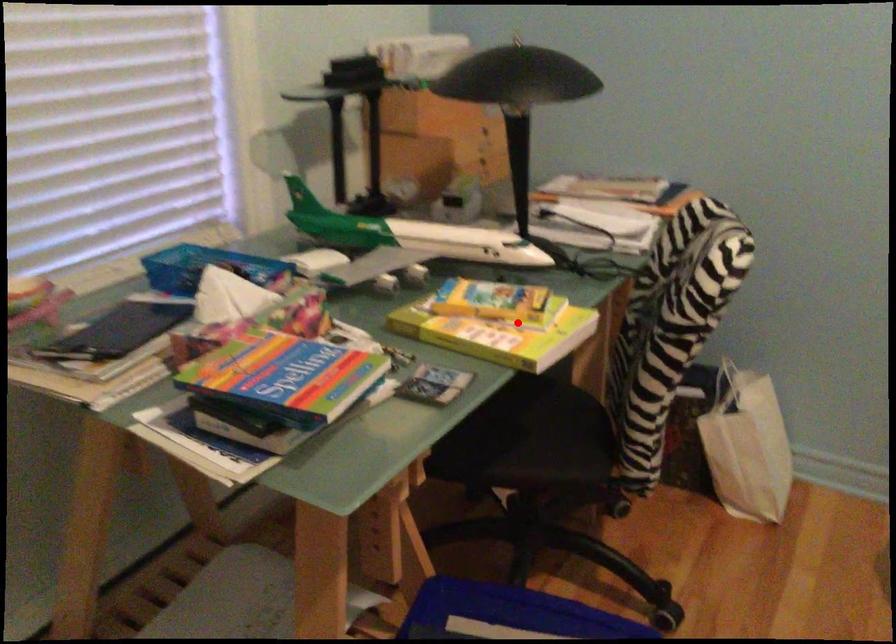
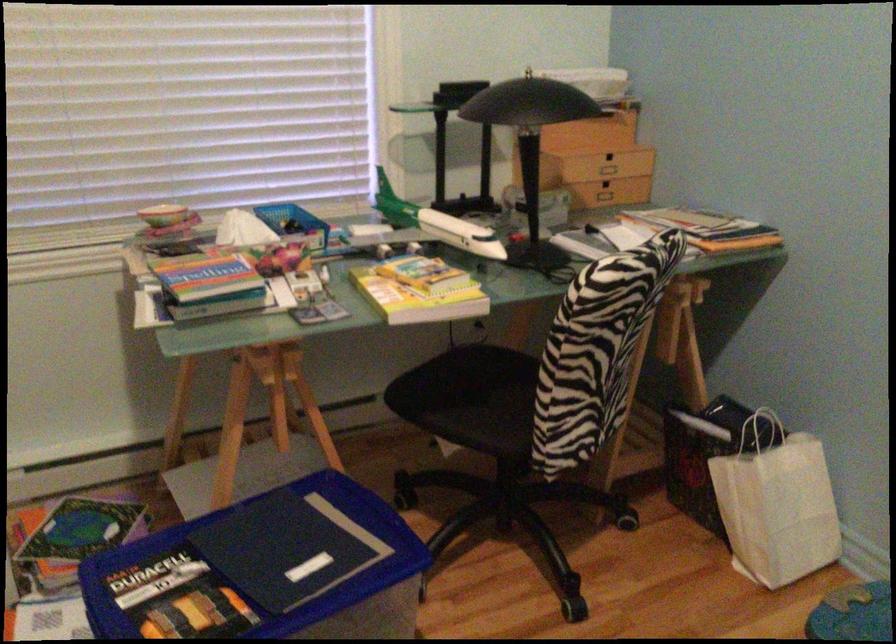
Find the pixel in the second image that matches the highlighted location in the first image.

(419, 290)